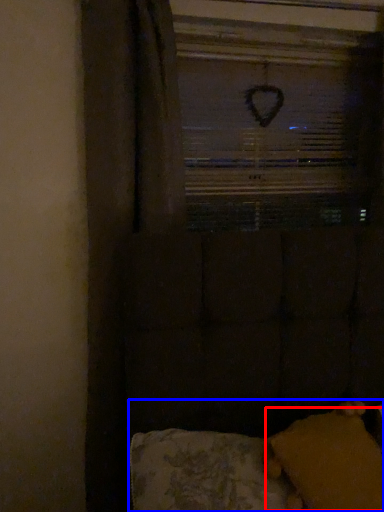
Question: Which object appears closest to the camera in this image, pillow (highlighted by a red box) or furniture (highlighted by a blue box)?

Choices:
 (A) pillow
 (B) furniture

Answer: (B)